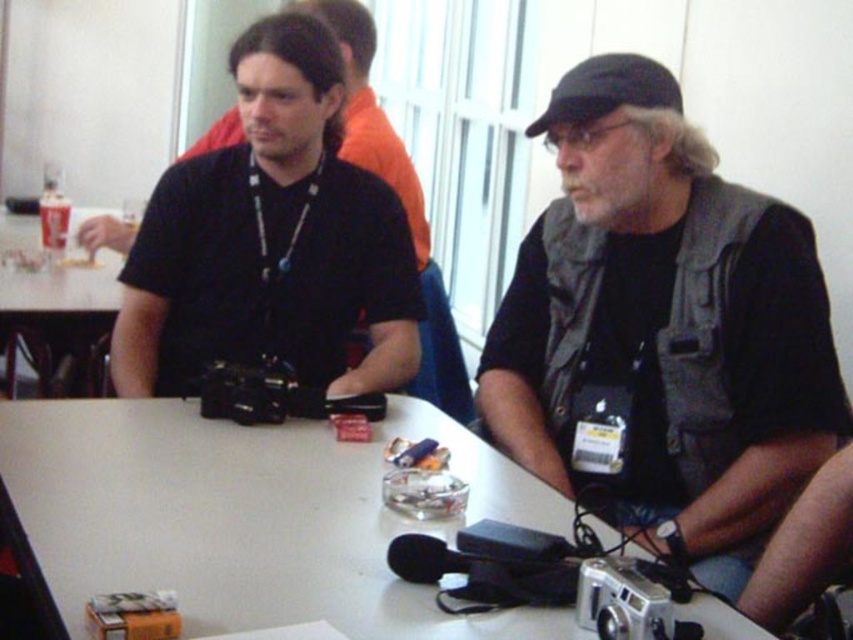
You are organizing a photography exhibition and need to arrange the two cameras on a shelf. The shelf has a width of 1 meter. The matte black camera at left is 30 cm wide and the silver metallic camera at lower center is 40 cm wide. Can both cameras fit side by side on the shelf without overlapping?

The matte black camera at left is 30 cm wide and the silver metallic camera at lower center is 40 cm wide. Combined, they total 70 cm. Since the shelf is 1 meter wide, which is 100 cm, there is enough space to place both cameras side by side without overlapping.

You are a photographer who needs to place a new camera on the table between the gray fabric vest at center and the silver metallic camera at lower center. Where should you place it so it doesn not block the existing items?

The gray fabric vest at center is to the right of the silver metallic camera at lower center, so placing the new camera to the left of the silver metallic camera at lower center would keep it out of the way of both items.